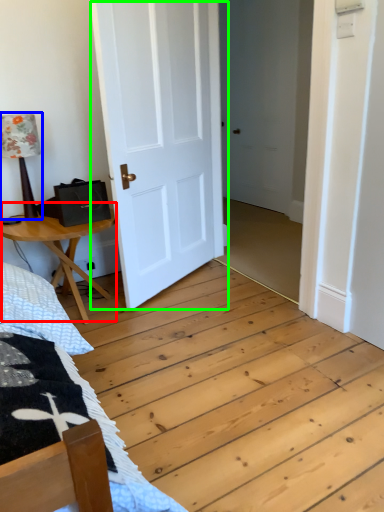
Question: Considering the real-world distances, which object is closest to table (highlighted by a red box)? table lamp (highlighted by a blue box) or door (highlighted by a green box).

Choices:
 (A) table lamp
 (B) door

Answer: (A)